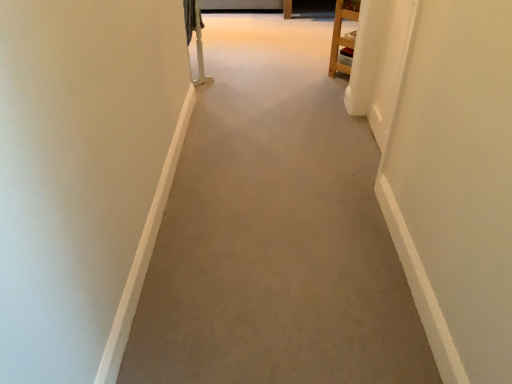
What do you see at coordinates (275, 231) in the screenshot? I see `beige carpet at center` at bounding box center [275, 231].

Measure the distance between beige carpet at center and camera.

beige carpet at center is 4.61 feet away from camera.

Identify the location of beige carpet at center. The image size is (512, 384). (275, 231).

Locate an element on the screen. beige carpet at center is located at coordinates (275, 231).